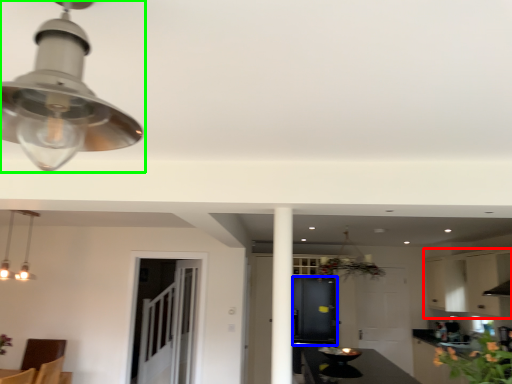
Question: Estimate the real-world distances between objects in this image. Which object is farther from cabinetry (highlighted by a red box), cabinetry (highlighted by a blue box) or lamp (highlighted by a green box)?

Choices:
 (A) cabinetry
 (B) lamp

Answer: (B)